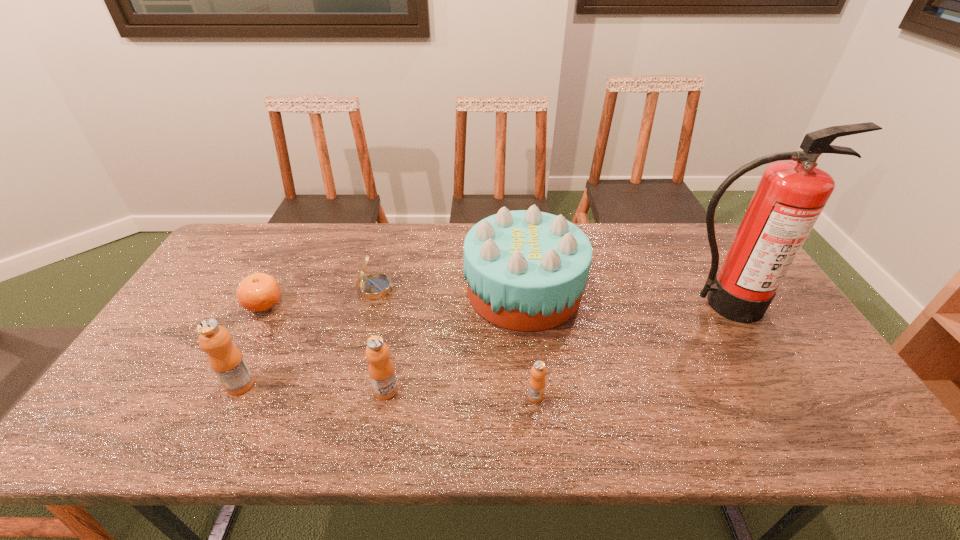
This screenshot has height=540, width=960. I want to click on vacant space at the near edge of the desktop, so click(334, 388).

Identify the location of vacant area at the left edge. The image size is (960, 540). (207, 308).

This screenshot has width=960, height=540. I want to click on vacant area at the far left corner of the desktop, so click(x=257, y=259).

Identify the location of free location at the far right corner. The height and width of the screenshot is (540, 960). (708, 241).

Image resolution: width=960 pixels, height=540 pixels. What are the coordinates of `empty location between the clementine and the fourth shortest object` in the screenshot? It's located at (325, 347).

Identify the location of vacant area that lies between the cake and the shortest object. (394, 296).

Identify the location of vacant area that lies between the cake and the rightmost object. This screenshot has width=960, height=540. (623, 297).

The image size is (960, 540). What are the coordinates of `free point between the shortest object and the cake` in the screenshot? It's located at (394, 296).

In order to click on unoccupied area between the second orange juice from left to right and the clementine in this screenshot , I will do `click(325, 347)`.

Choose which object is the fifth nearest neighbor to the fire extinguisher. Please provide its 2D coordinates. Your answer should be formatted as a tuple, i.e. [(x, y)], where the tuple contains the x and y coordinates of a point satisfying the conditions above.

[(226, 360)]